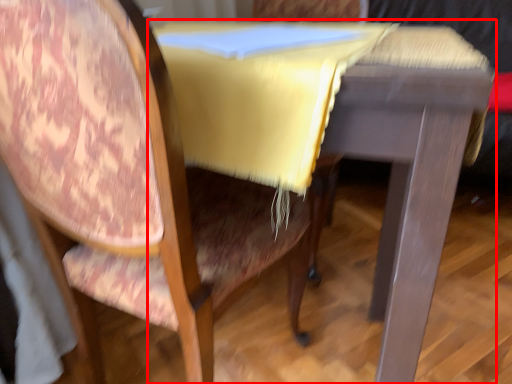
Question: In this image, where is table (annotated by the red box) located relative to chair?

Choices:
 (A) right
 (B) left

Answer: (A)